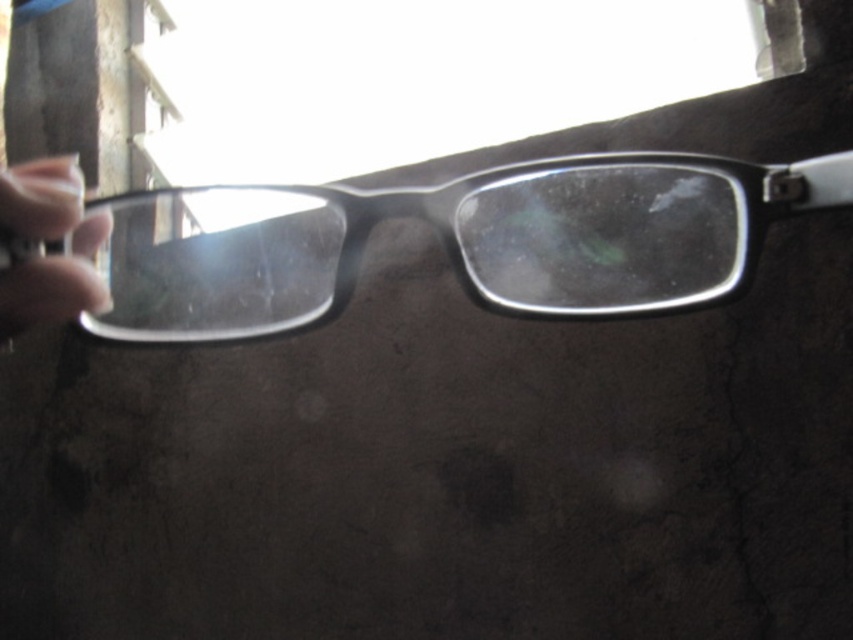
Is point (641, 257) closer to viewer compared to point (36, 204)?

That is False.

Is point (164, 282) farther from camera compared to point (10, 332)?

That is True.

Is point (599, 291) positioned behind point (24, 323)?

Yes, point (599, 291) is behind point (24, 323).

This screenshot has height=640, width=853. Identify the location of transparent plastic glasses at upper center. (453, 241).